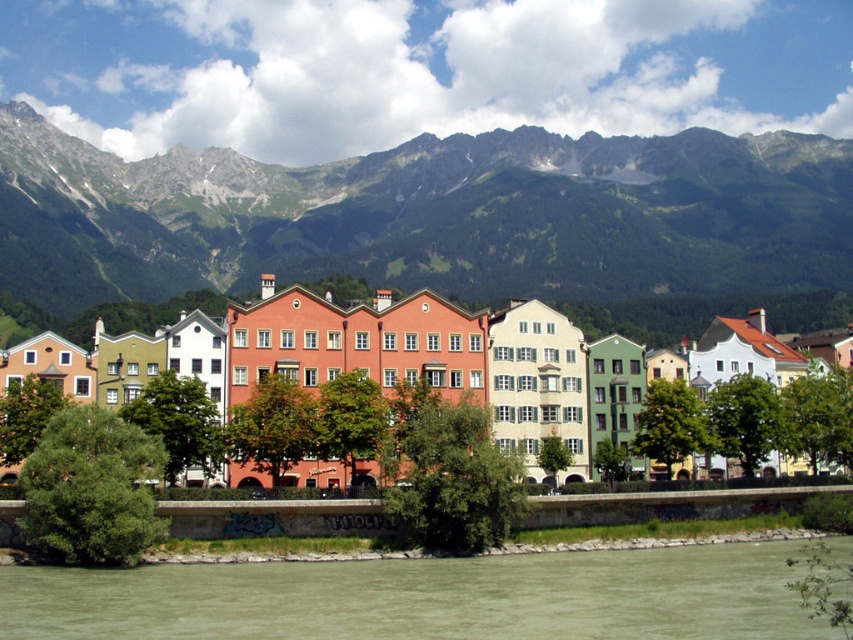
Question: Can you confirm if green rocky mountains at upper center is positioned below greenish-brown water at lower center?

Choices:
 (A) no
 (B) yes

Answer: (A)

Question: Can you confirm if green rocky mountains at upper center is wider than greenish-brown water at lower center?

Choices:
 (A) yes
 (B) no

Answer: (A)

Question: Which of the following is the farthest from the observer?

Choices:
 (A) green rocky mountains at upper center
 (B) greenish-brown water at lower center

Answer: (A)

Question: Does green rocky mountains at upper center lie behind greenish-brown water at lower center?

Choices:
 (A) yes
 (B) no

Answer: (A)

Question: Which object appears farthest from the camera in this image?

Choices:
 (A) greenish-brown water at lower center
 (B) green rocky mountains at upper center

Answer: (B)